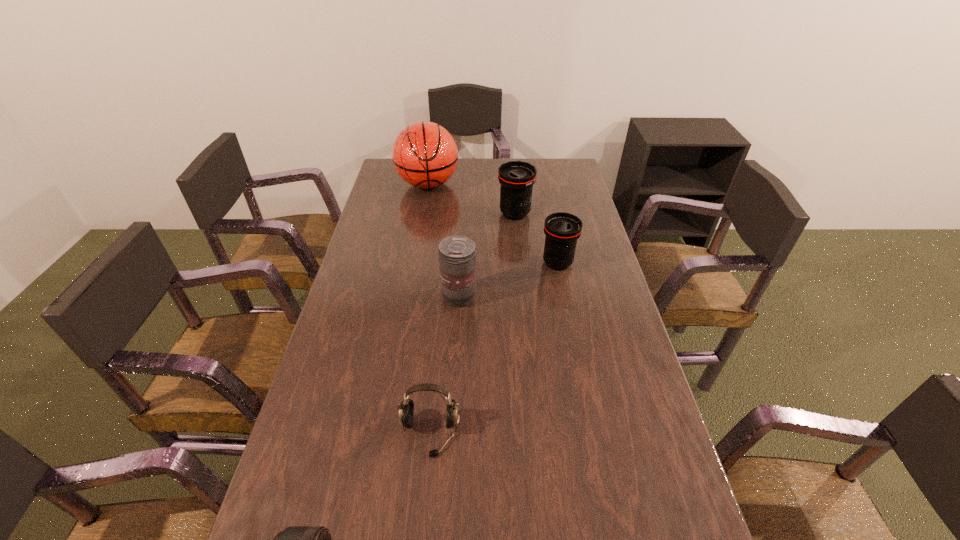
This screenshot has height=540, width=960. Find the location of `free space located 0.330m on the back of the second farthest telephoto lens`. free space located 0.330m on the back of the second farthest telephoto lens is located at coordinates (545, 200).

This screenshot has width=960, height=540. In order to click on free spot located 0.090m with the microphone on the side of the fifth farthest object in this screenshot , I will do `click(423, 502)`.

Where is `object present at the far edge`? The height and width of the screenshot is (540, 960). object present at the far edge is located at coordinates (425, 155).

Image resolution: width=960 pixels, height=540 pixels. I want to click on object that is positioned at the left edge, so click(x=425, y=155).

This screenshot has height=540, width=960. I want to click on object present at the right edge, so click(x=562, y=230).

This screenshot has width=960, height=540. What are the coordinates of `object located at the far left corner` in the screenshot? It's located at (425, 155).

The image size is (960, 540). Find the location of `blank space at the far edge of the desktop`. blank space at the far edge of the desktop is located at coordinates 531,164.

Find the location of `free region at the left edge`. free region at the left edge is located at coordinates [x=399, y=201].

The image size is (960, 540). In order to click on vacant space at the right edge of the desktop in this screenshot , I will do `click(584, 318)`.

Locate an element on the screen. Image resolution: width=960 pixels, height=540 pixels. free spot at the far left corner of the desktop is located at coordinates (389, 176).